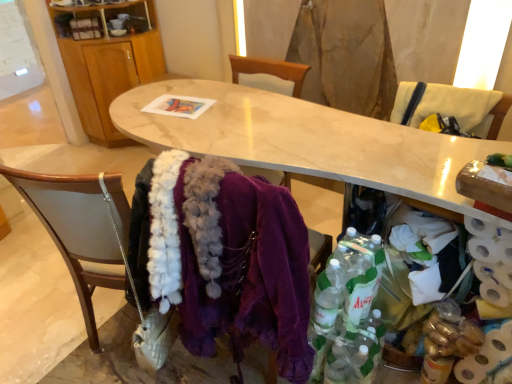
Question: From the image's perspective, would you say wooden chair at lower left, which ranks as the first chair in left-to-right order, is shown under wooden cabinet at upper left?

Choices:
 (A) yes
 (B) no

Answer: (A)

Question: Are wooden chair at lower left, which is counted as the 2th chair, starting from the top, and wooden cabinet at upper left beside each other?

Choices:
 (A) yes
 (B) no

Answer: (B)

Question: Is wooden cabinet at upper left surrounded by wooden chair at lower left, which ranks as the first chair in left-to-right order?

Choices:
 (A) yes
 (B) no

Answer: (B)

Question: Is wooden chair at lower left, marked as the 1th chair in a bottom-to-top arrangement, to the left of wooden cabinet at upper left from the viewer's perspective?

Choices:
 (A) no
 (B) yes

Answer: (A)

Question: Does wooden chair at lower left, which is counted as the 2th chair, starting from the top, lie in front of wooden cabinet at upper left?

Choices:
 (A) no
 (B) yes

Answer: (B)

Question: Is wooden chair at lower left, which is counted as the 2th chair, starting from the top, completely or partially outside of wooden cabinet at upper left?

Choices:
 (A) yes
 (B) no

Answer: (A)

Question: Considering the relative positions of wooden armchair at right and marble table at center in the image provided, is wooden armchair at right to the left of marble table at center from the viewer's perspective?

Choices:
 (A) no
 (B) yes

Answer: (A)

Question: From the image's perspective, is wooden armchair at right located beneath marble table at center?

Choices:
 (A) yes
 (B) no

Answer: (B)

Question: Does wooden armchair at right come behind marble table at center?

Choices:
 (A) yes
 (B) no

Answer: (A)

Question: Is wooden armchair at right shorter than marble table at center?

Choices:
 (A) yes
 (B) no

Answer: (B)

Question: Is marble table at center surrounded by wooden armchair at right?

Choices:
 (A) yes
 (B) no

Answer: (B)

Question: From the image's perspective, is wooden armchair at right on marble table at center?

Choices:
 (A) no
 (B) yes

Answer: (B)

Question: Is white textured toilet paper at lower right at the right side of wooden chair at lower left, marked as the 1th chair in a bottom-to-top arrangement?

Choices:
 (A) yes
 (B) no

Answer: (A)